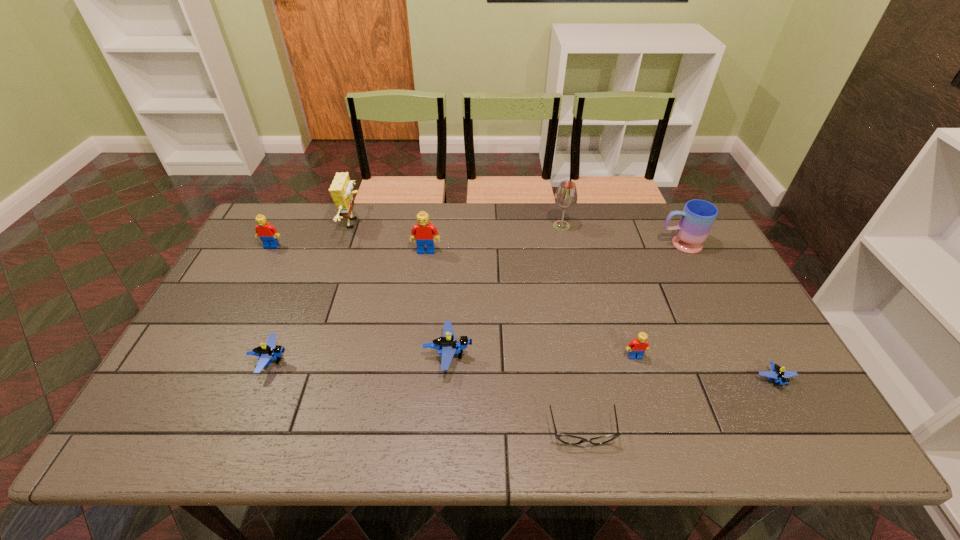
I want to click on mug that is positioned at the far edge, so click(697, 218).

Where is `Lego at the far edge`? The height and width of the screenshot is (540, 960). Lego at the far edge is located at coordinates (267, 233).

Find the location of a particular element. The width and height of the screenshot is (960, 540). object situated at the near edge is located at coordinates (564, 438).

Identify the location of object at the left edge. The image size is (960, 540). (267, 233).

At what (x,y) coordinates should I click in order to perform the action: click on mug at the right edge. Please return your answer as a coordinate pair (x, y). This screenshot has width=960, height=540. Looking at the image, I should click on (697, 218).

This screenshot has height=540, width=960. I want to click on Lego that is at the right edge, so click(781, 377).

Find the location of `object located in the far left corner section of the desktop`. object located in the far left corner section of the desktop is located at coordinates (267, 233).

The height and width of the screenshot is (540, 960). Find the location of `object present at the far right corner`. object present at the far right corner is located at coordinates (697, 218).

Locate an element on the screen. The width and height of the screenshot is (960, 540). vacant space at the far edge of the desktop is located at coordinates (329, 220).

Find the location of a particular element. This screenshot has height=540, width=960. free space at the near edge of the desktop is located at coordinates (727, 422).